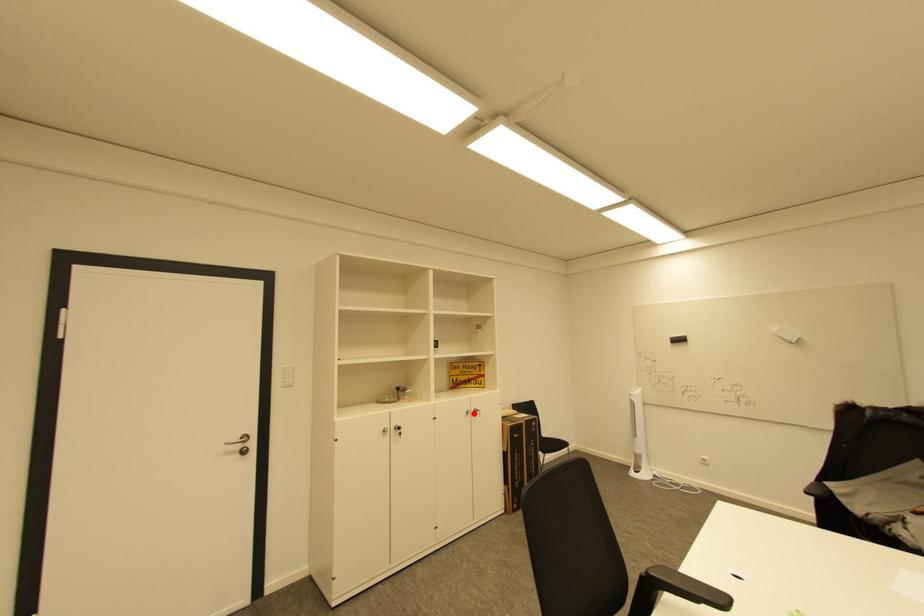
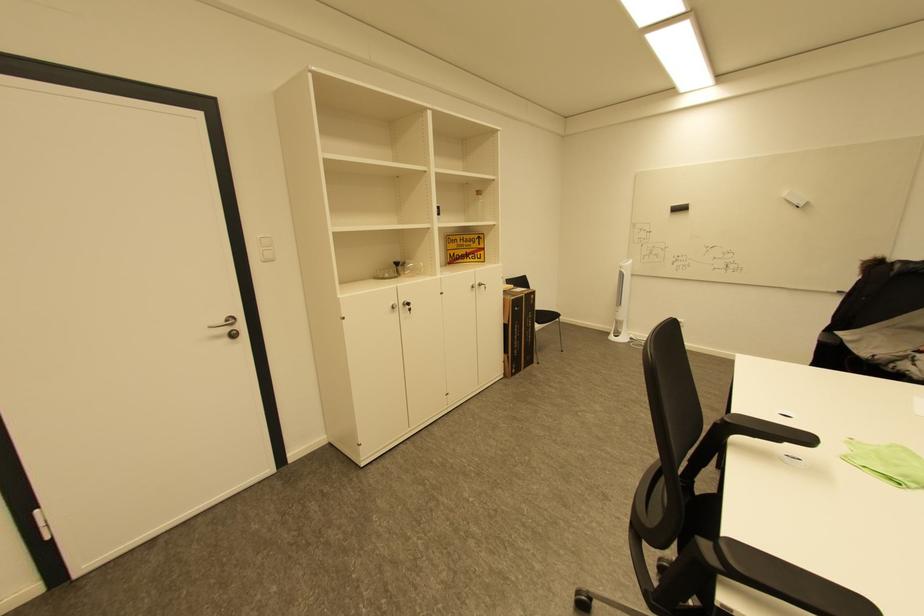
The point at the highlighted location is marked in the first image. Where is the corresponding point in the second image?

(479, 286)